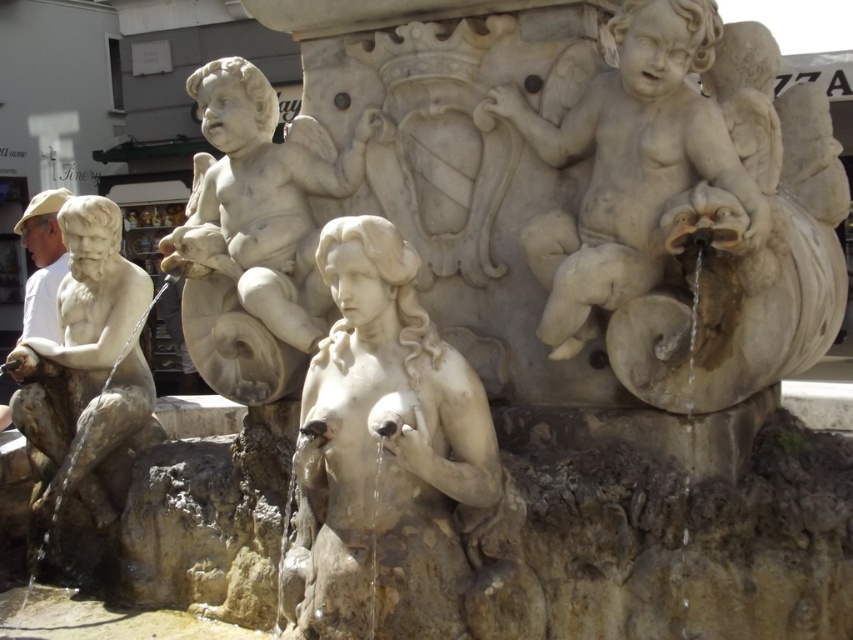
Which is behind, point (497, 92) or point (82, 198)?

Positioned behind is point (82, 198).

Is white marble cherub at upper right below matte stone man at left?

No, white marble cherub at upper right is not below matte stone man at left.

Which is in front, point (619, 182) or point (64, 449)?

Point (619, 182)

This screenshot has height=640, width=853. I want to click on white marble cherub at upper right, so [628, 164].

Which is more to the left, white marble cherub at upper right or white marble cherub at upper center?

→ white marble cherub at upper center

Is white marble cherub at upper right to the right of white marble cherub at upper center from the viewer's perspective?

Yes, white marble cherub at upper right is to the right of white marble cherub at upper center.

Find the location of a particular element. Image resolution: width=853 pixels, height=640 pixels. white marble cherub at upper right is located at coordinates (628, 164).

You are a GUI agent. You are given a task and a screenshot of the screen. Output one action in this format:
    pyautogui.click(x=<x>, y=<y>)
    Task: Click on the white marble cherub at upper right
    This screenshot has height=640, width=853.
    Given the screenshot: What is the action you would take?
    pyautogui.click(x=628, y=164)

Can you confirm if white marble statue at center is bigger than white marble cherub at upper right?

Yes, white marble statue at center is bigger than white marble cherub at upper right.

Is white marble statue at center taller than white marble cherub at upper right?

Yes, white marble statue at center is taller than white marble cherub at upper right.

Image resolution: width=853 pixels, height=640 pixels. I want to click on white marble statue at center, so click(376, 428).

This screenshot has width=853, height=640. Identify the location of white marble statue at center. (376, 428).